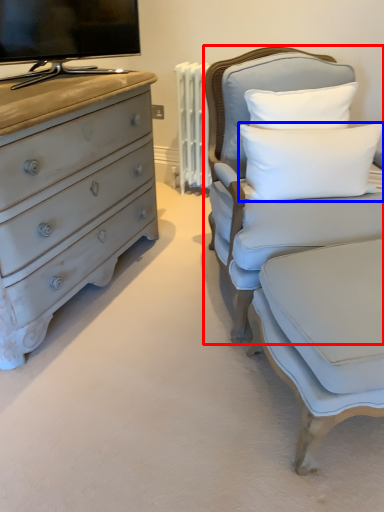
Question: Which object appears farthest to the camera in this image, chair (highlighted by a red box) or pillow (highlighted by a blue box)?

Choices:
 (A) chair
 (B) pillow

Answer: (B)